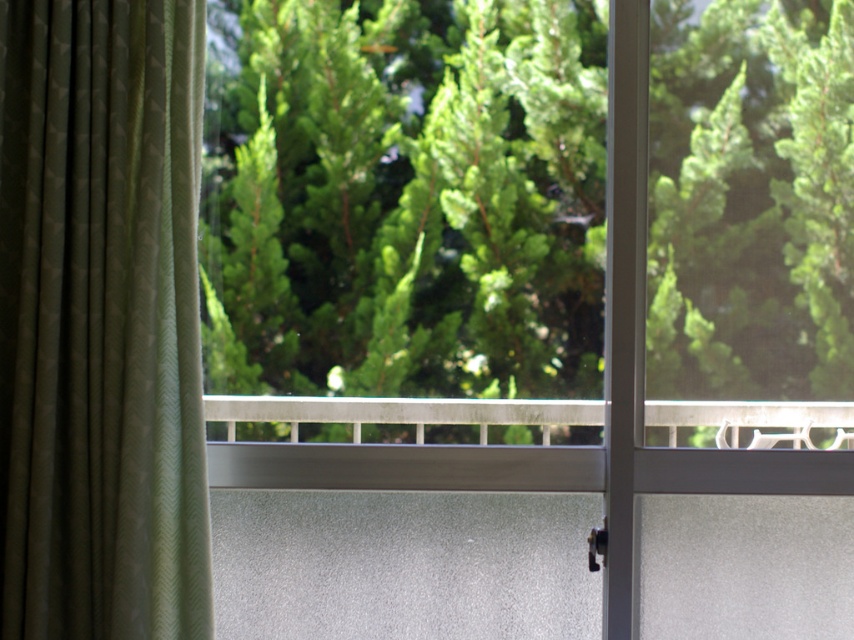
Question: Does green leafy tree at upper center come behind satin silver rail at center?

Choices:
 (A) yes
 (B) no

Answer: (A)

Question: Does green leafy tree at upper center have a lesser width compared to satin silver rail at center?

Choices:
 (A) yes
 (B) no

Answer: (B)

Question: Where is green leafy tree at upper center located in relation to green textured curtain at left in the image?

Choices:
 (A) right
 (B) left

Answer: (A)

Question: Which of these objects is positioned farthest from the green textured curtain at left?

Choices:
 (A) green leafy tree at upper center
 (B) satin silver rail at center

Answer: (A)

Question: Which object is the closest to the green textured curtain at left?

Choices:
 (A) satin silver rail at center
 (B) green leafy tree at upper center

Answer: (A)

Question: Which point is closer to the camera?

Choices:
 (A) green textured curtain at left
 (B) satin silver rail at center

Answer: (A)